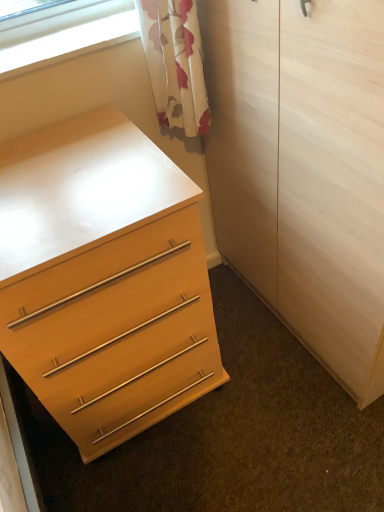
Question: From a real-world perspective, is clear glass window at upper left physically above light wood/texture armoire at center?

Choices:
 (A) no
 (B) yes

Answer: (B)

Question: Does clear glass window at upper left have a lesser height compared to light wood/texture armoire at center?

Choices:
 (A) no
 (B) yes

Answer: (B)

Question: Is clear glass window at upper left at the right side of light wood/texture armoire at center?

Choices:
 (A) yes
 (B) no

Answer: (B)

Question: Considering the relative sizes of clear glass window at upper left and light wood/texture armoire at center in the image provided, is clear glass window at upper left wider than light wood/texture armoire at center?

Choices:
 (A) yes
 (B) no

Answer: (B)

Question: From the image's perspective, does clear glass window at upper left appear higher than light wood/texture armoire at center?

Choices:
 (A) yes
 (B) no

Answer: (A)

Question: Does clear glass window at upper left come in front of light wood/texture armoire at center?

Choices:
 (A) yes
 (B) no

Answer: (B)

Question: Is matte wood chest of drawers at lower left oriented away from clear glass window at upper left?

Choices:
 (A) no
 (B) yes

Answer: (A)

Question: Can you confirm if matte wood chest of drawers at lower left is thinner than clear glass window at upper left?

Choices:
 (A) no
 (B) yes

Answer: (A)

Question: From the image's perspective, is matte wood chest of drawers at lower left located beneath clear glass window at upper left?

Choices:
 (A) yes
 (B) no

Answer: (A)

Question: Does matte wood chest of drawers at lower left come behind clear glass window at upper left?

Choices:
 (A) yes
 (B) no

Answer: (B)

Question: Is matte wood chest of drawers at lower left wider than clear glass window at upper left?

Choices:
 (A) no
 (B) yes

Answer: (B)

Question: Can you confirm if matte wood chest of drawers at lower left is smaller than clear glass window at upper left?

Choices:
 (A) yes
 (B) no

Answer: (B)

Question: From the image's perspective, would you say clear glass window at upper left is shown under matte wood chest of drawers at lower left?

Choices:
 (A) no
 (B) yes

Answer: (A)